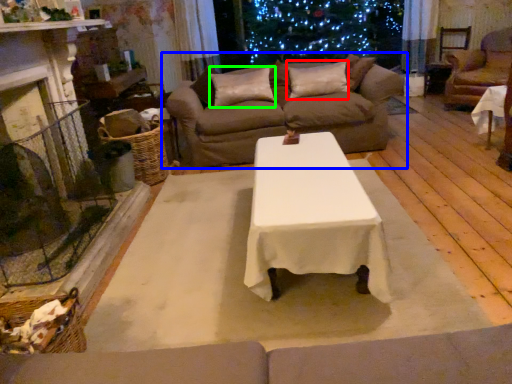
Question: Which is nearer to the pillow (highlighted by a red box)? studio couch (highlighted by a blue box) or pillow (highlighted by a green box).

Choices:
 (A) studio couch
 (B) pillow

Answer: (B)